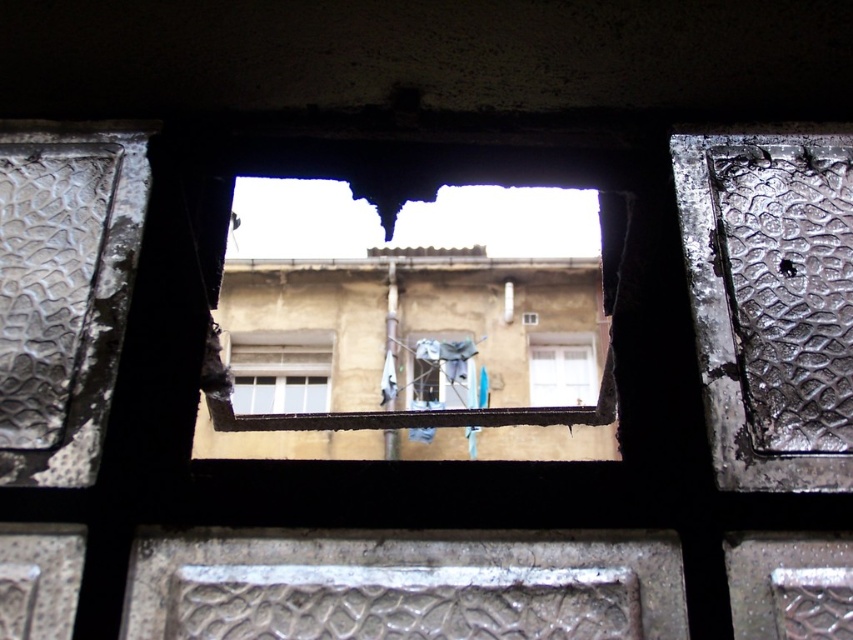
Question: In this image, where is white matte window at center located relative to white plastic window at center?

Choices:
 (A) above
 (B) below

Answer: (B)

Question: Which object appears farthest from the camera in this image?

Choices:
 (A) white matte window at center
 (B) white plastic window at center

Answer: (B)

Question: Can you confirm if white matte window at center is wider than white plastic window at center?

Choices:
 (A) yes
 (B) no

Answer: (A)

Question: Can you confirm if white matte window at center is positioned to the right of white plastic window at center?

Choices:
 (A) yes
 (B) no

Answer: (B)

Question: Which of the following is the farthest from the observer?

Choices:
 (A) white matte window at center
 (B) white plastic window at center

Answer: (B)

Question: Which of the following is the farthest from the observer?

Choices:
 (A) white matte window at center
 (B) white plastic window at center

Answer: (B)